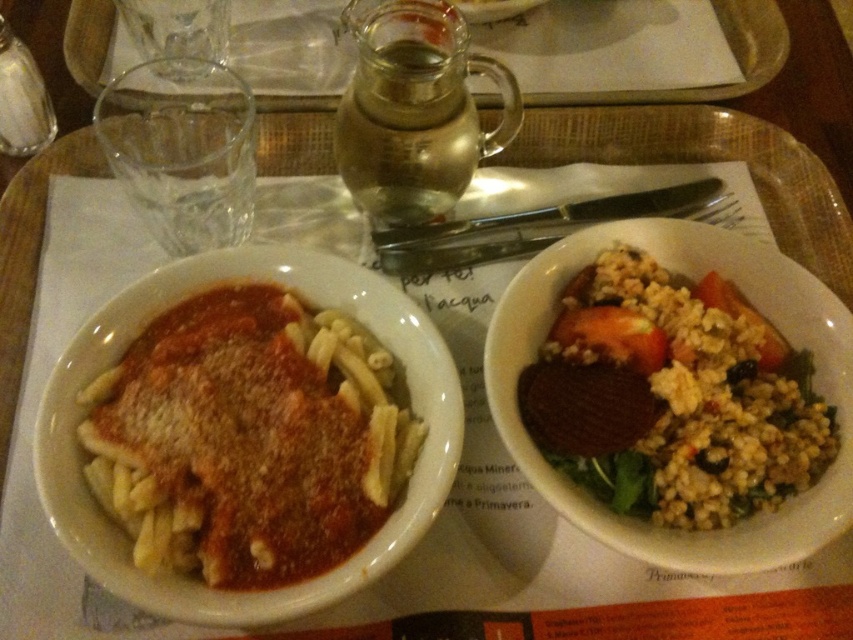
Looking at this image, does white matte pasta at center appear under brown crumbly grain at right?

Yes.

Can you confirm if white matte pasta at center is wider than brown crumbly grain at right?

No, white matte pasta at center is not wider than brown crumbly grain at right.

Looking at this image, who is more distant from viewer, (115, 371) or (724, 436)?

The point (115, 371) is behind.

This screenshot has height=640, width=853. I want to click on white matte pasta at center, so point(248,436).

What do you see at coordinates (248, 436) in the screenshot?
I see `white matte pasta at center` at bounding box center [248, 436].

Who is more distant from viewer, (328, 540) or (67, 42)?

Positioned behind is point (67, 42).

Is point (260, 365) less distant than point (68, 54)?

Yes, point (260, 365) is in front of point (68, 54).

Locate an element on the screen. Image resolution: width=853 pixels, height=640 pixels. white matte pasta at center is located at coordinates (248, 436).

Does brown crumbly grain at right have a lesser height compared to clear glass pitcher at upper center?

No.

Does brown crumbly grain at right lie in front of clear glass pitcher at upper center?

That is True.

The image size is (853, 640). What do you see at coordinates (675, 397) in the screenshot? I see `brown crumbly grain at right` at bounding box center [675, 397].

You are a GUI agent. You are given a task and a screenshot of the screen. Output one action in this format:
    pyautogui.click(x=<x>, y=<y>)
    Task: Click on the brown crumbly grain at right
    
    Given the screenshot: What is the action you would take?
    pyautogui.click(x=675, y=397)